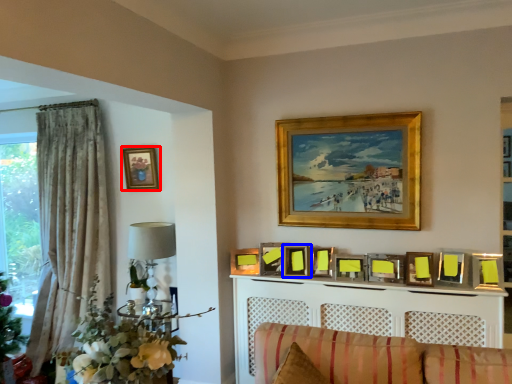
Question: Which point is closer to the camera, picture frame (highlighted by a red box) or picture frame (highlighted by a blue box)?

Choices:
 (A) picture frame
 (B) picture frame

Answer: (B)